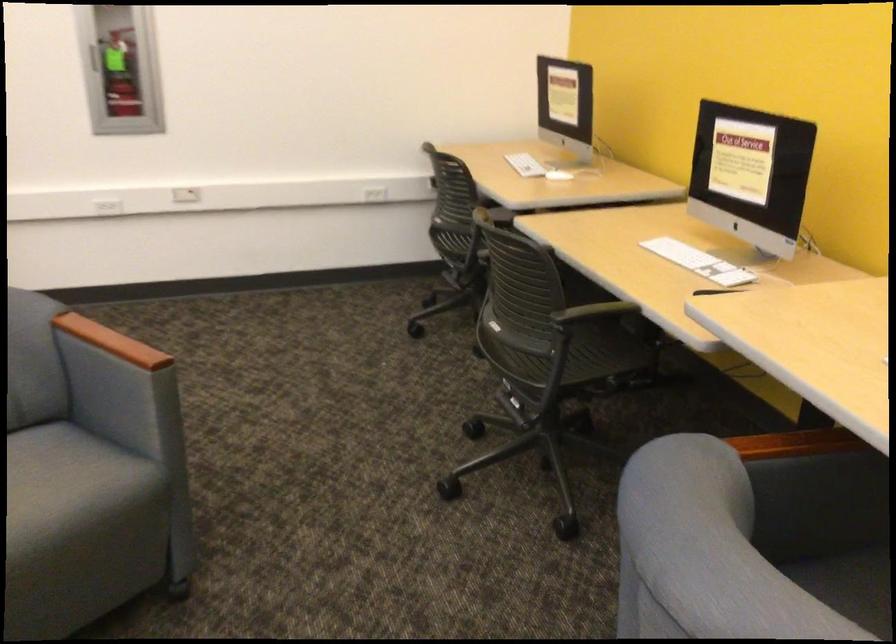
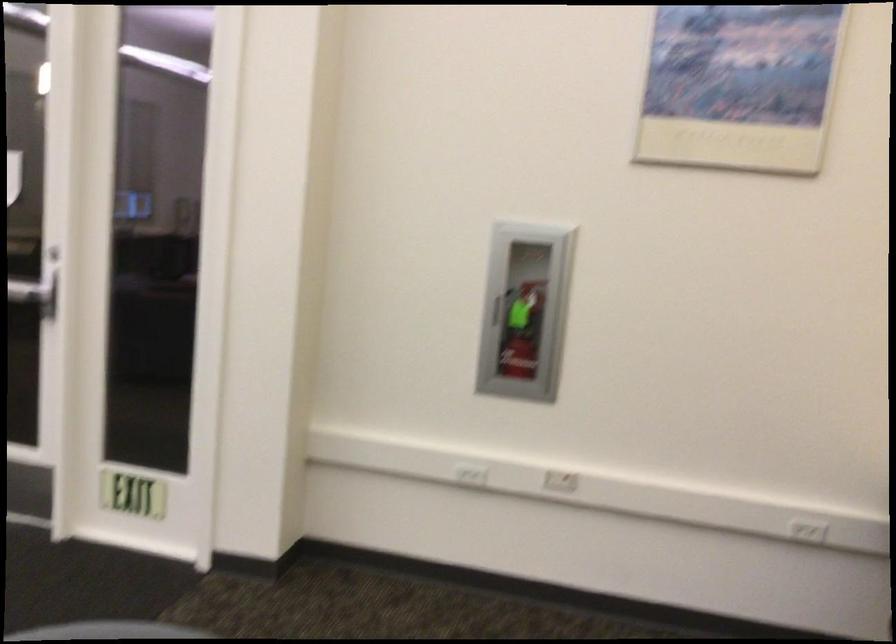
Question: Based on the continuous images, in which direction is the camera rotating? Reply with the corresponding letter.

Choices:
 (A) Left
 (B) Right
 (C) Up
 (D) Down

Answer: (A)